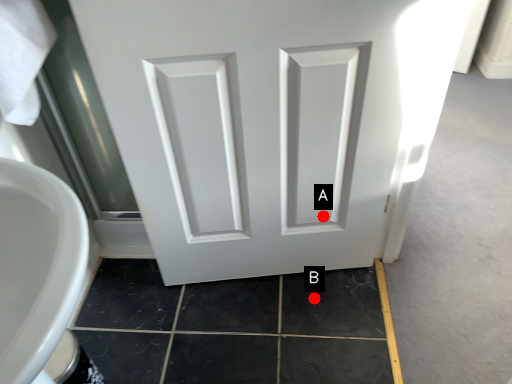
Question: Two points are circled on the image, labeled by A and B beside each circle. Which of the following is the farthest from the observer?

Choices:
 (A) A is further
 (B) B is further

Answer: (B)